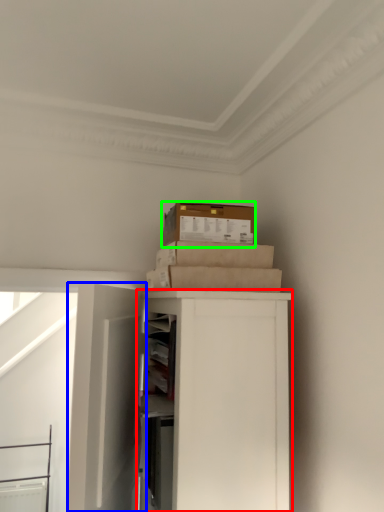
Question: Considering the real-world distances, which object is farthest from cabinetry (highlighted by a red box)? door (highlighted by a blue box) or box (highlighted by a green box)?

Choices:
 (A) door
 (B) box

Answer: (B)